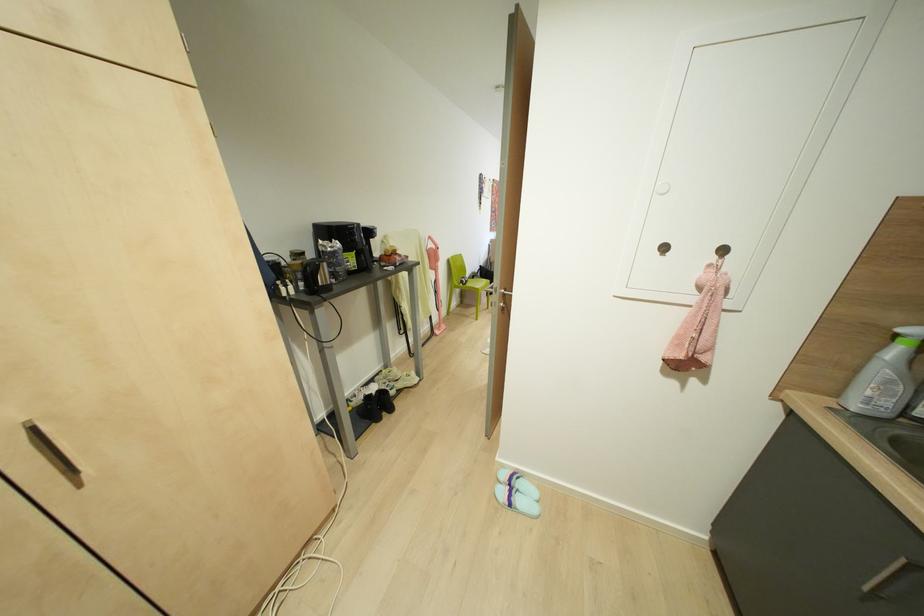
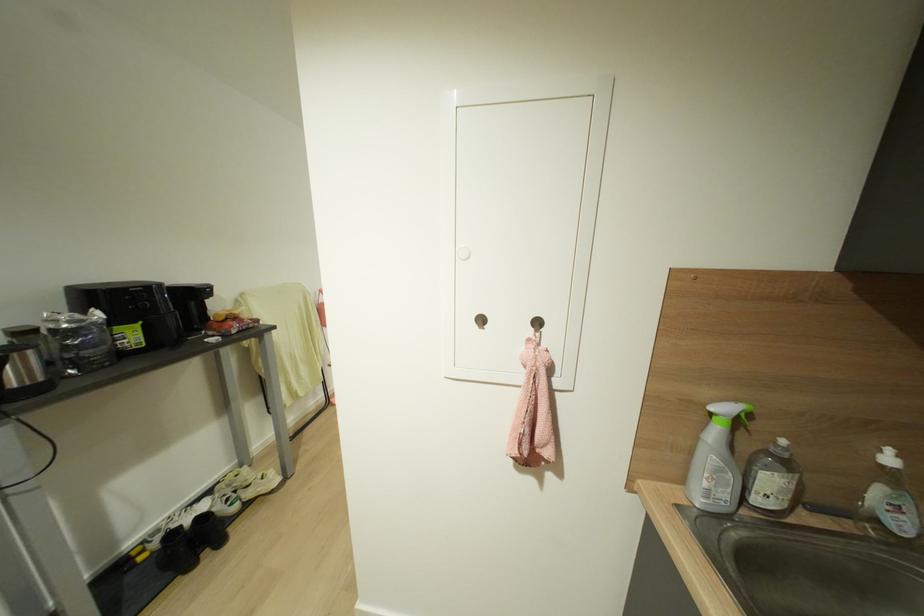
Find the pixel in the second image that matches [664,248] in the first image.

(480, 320)